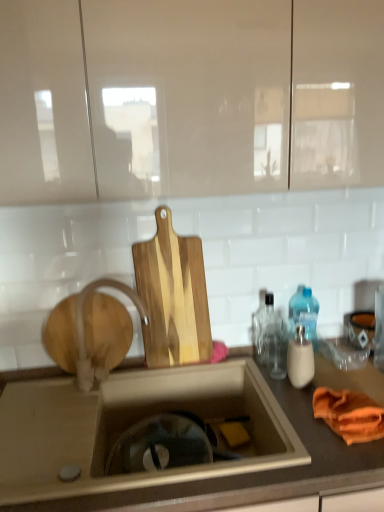
This screenshot has height=512, width=384. I want to click on vacant space behind orange cloth at right, so click(x=334, y=381).